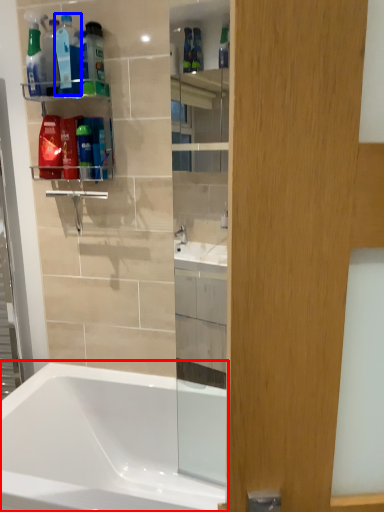
Question: Among these objects, which one is nearest to the camera, bathtub (highlighted by a red box) or cleaning product (highlighted by a blue box)?

Choices:
 (A) bathtub
 (B) cleaning product

Answer: (A)